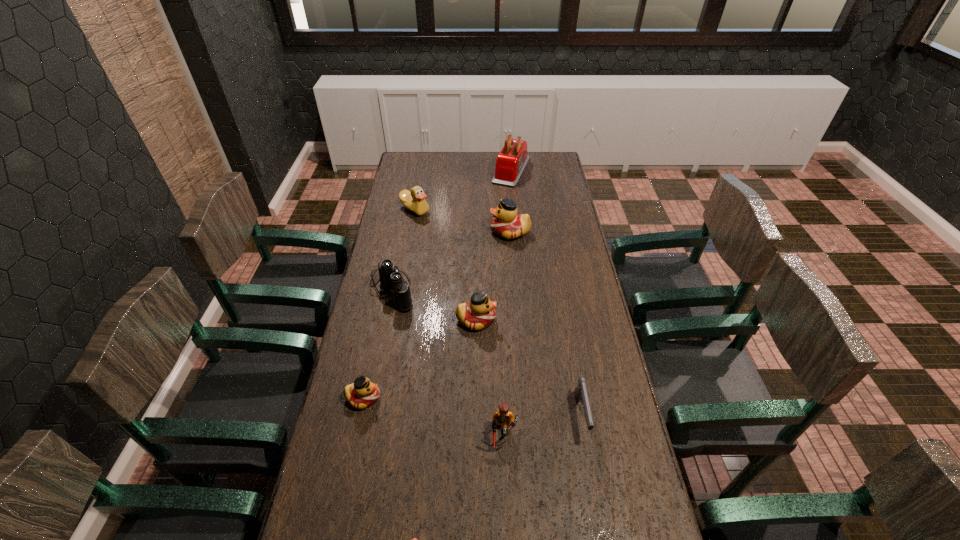
In the image, there is a desktop. At what (x,y) coordinates should I click in order to perform the action: click on vacant area at the right edge. Please return your answer as a coordinate pair (x, y). This screenshot has height=540, width=960. Looking at the image, I should click on (573, 308).

In the image, there is a desktop. At what (x,y) coordinates should I click in order to perform the action: click on vacant space at the far right corner. Please return your answer as a coordinate pair (x, y). The width and height of the screenshot is (960, 540). Looking at the image, I should click on (549, 164).

Identify the location of free space between the bigger beige duck and the farthest object. The height and width of the screenshot is (540, 960). (463, 190).

Locate an element on the screen. This screenshot has width=960, height=540. vacant region between the pistol and the seventh nearest object is located at coordinates (545, 324).

Find the location of a particular element. This screenshot has height=540, width=960. unoccupied position between the bigger beige duck and the second smallest red duck is located at coordinates (445, 265).

The image size is (960, 540). I want to click on vacant space in between the bigger beige duck and the Lego, so click(457, 322).

You are a GUI agent. You are given a task and a screenshot of the screen. Output one action in this format:
    pyautogui.click(x=<x>, y=<y>)
    Task: Click on the vacant region between the Lego and the leftmost red duck
    
    Given the screenshot: What is the action you would take?
    tap(431, 416)

Locate an element on the screen. free area in between the biggest red duck and the second biggest red duck is located at coordinates (492, 276).

Identify which object is located as the fifth nearest to the farthest object. Please provide its 2D coordinates. Your answer should be formatted as a tuple, i.e. [(x, y)], where the tuple contains the x and y coordinates of a point satisfying the conditions above.

[(580, 393)]

Identify which object is located as the nearest to the biggest red duck. Please provide its 2D coordinates. Your answer should be formatted as a tuple, i.e. [(x, y)], where the tuple contains the x and y coordinates of a point satisfying the conditions above.

[(414, 200)]